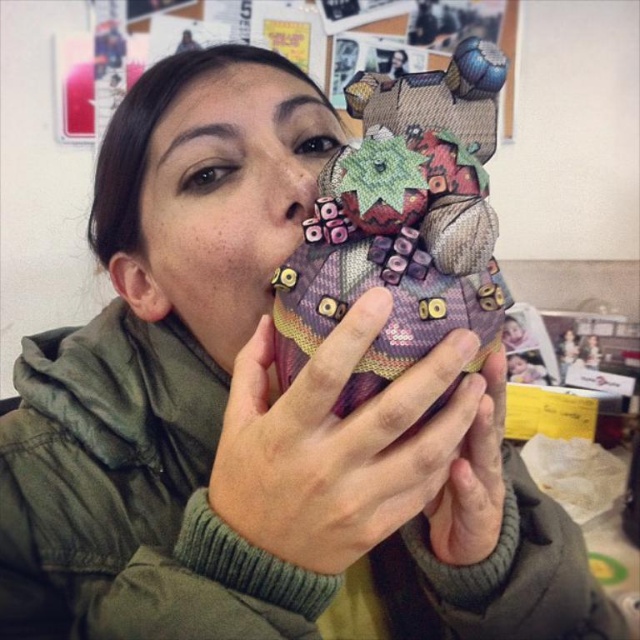
You are a photographer standing 10 inches away from the plaid fabric bear at center. You want to take a closeup shot without getting closer than 10 inches. Is the current distance sufficient for a clear closeup?

The plaid fabric bear at center is 12.54 inches away from the viewer, which is more than the 10 inches minimum distance you want to maintain. Therefore, the current distance is sufficient for a clear closeup without moving closer than 10 inches.

Based on the photo, you are an interior designer who needs to arrange two items in a display case. The items are the plaid fabric bear at center and the matte purple fabric at center. The display case has a height limit of 12 inches. Which item should you choose to ensure it fits within the height restriction?

The matte purple fabric at center is shorter than the plaid fabric bear at center, so the matte purple fabric at center should be chosen to ensure it fits within the 12 inch height restriction.